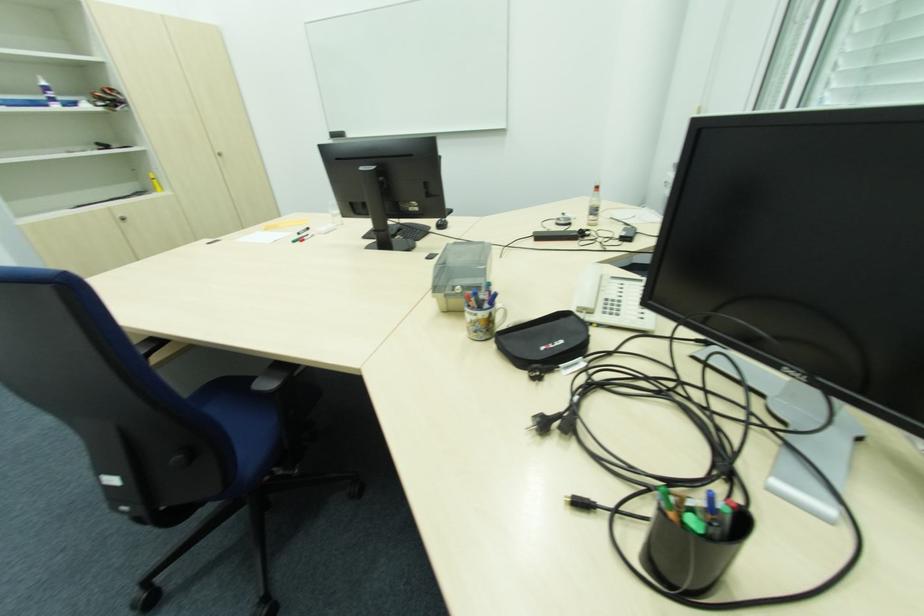
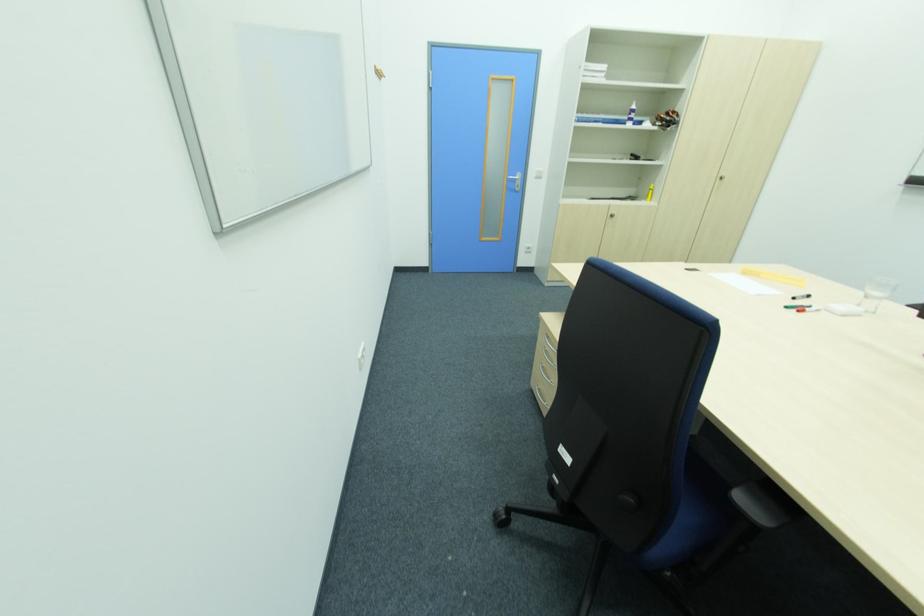
Question: The camera is either moving clockwise (left) or counter-clockwise (right) around the object. The first image is from the beginning of the video and the second image is from the end. Is the camera moving left or right when shooting the video?

Choices:
 (A) Left
 (B) Right

Answer: (B)